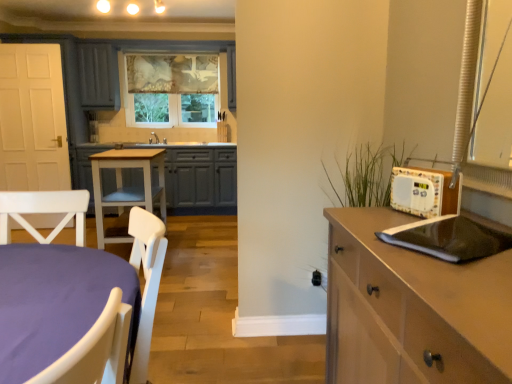
Question: Considering the relative sizes of white wood table at center and black matte laptop at right in the image provided, is white wood table at center thinner than black matte laptop at right?

Choices:
 (A) yes
 (B) no

Answer: (B)

Question: Does white wood table at center lie in front of black matte laptop at right?

Choices:
 (A) yes
 (B) no

Answer: (B)

Question: Considering the relative positions of white wood table at center and black matte laptop at right in the image provided, is white wood table at center to the left of black matte laptop at right from the viewer's perspective?

Choices:
 (A) yes
 (B) no

Answer: (A)

Question: Can you confirm if white wood table at center is positioned to the right of black matte laptop at right?

Choices:
 (A) yes
 (B) no

Answer: (B)

Question: Is white wood table at center next to black matte laptop at right and touching it?

Choices:
 (A) yes
 (B) no

Answer: (B)

Question: Which is correct: textured fabric window at center is inside white wood table at center, or outside of it?

Choices:
 (A) outside
 (B) inside

Answer: (A)

Question: Considering the positions of textured fabric window at center and white wood table at center in the image, is textured fabric window at center taller or shorter than white wood table at center?

Choices:
 (A) short
 (B) tall

Answer: (B)

Question: Considering the positions of textured fabric window at center and white wood table at center in the image, is textured fabric window at center bigger or smaller than white wood table at center?

Choices:
 (A) big
 (B) small

Answer: (B)

Question: Is point (158, 76) closer or farther from the camera than point (113, 233)?

Choices:
 (A) closer
 (B) farther

Answer: (B)

Question: From a real-world perspective, is light brown wood cabinet at right, which appears as the second cabinetry when viewed from the left, positioned above or below matte gray cabinet at center, which ranks as the first cabinetry in left-to-right order?

Choices:
 (A) below
 (B) above

Answer: (B)

Question: Is light brown wood cabinet at right, the first cabinetry viewed from the front, bigger or smaller than matte gray cabinet at center, positioned as the first cabinetry in back-to-front order?

Choices:
 (A) big
 (B) small

Answer: (B)

Question: Looking at their shapes, would you say light brown wood cabinet at right, placed as the first cabinetry when sorted from right to left, is wider or thinner than matte gray cabinet at center, positioned as the first cabinetry in top-to-bottom order?

Choices:
 (A) wide
 (B) thin

Answer: (B)

Question: Is light brown wood cabinet at right, positioned as the 2th cabinetry in back-to-front order, situated inside matte gray cabinet at center, which appears as the second cabinetry when viewed from the front, or outside?

Choices:
 (A) inside
 (B) outside

Answer: (B)

Question: Is light brown wood cabinet at right, which is the 2th cabinetry from top to bottom, taller or shorter than black matte laptop at right?

Choices:
 (A) tall
 (B) short

Answer: (A)

Question: Would you say light brown wood cabinet at right, placed as the first cabinetry when sorted from right to left, is inside or outside black matte laptop at right?

Choices:
 (A) outside
 (B) inside

Answer: (A)